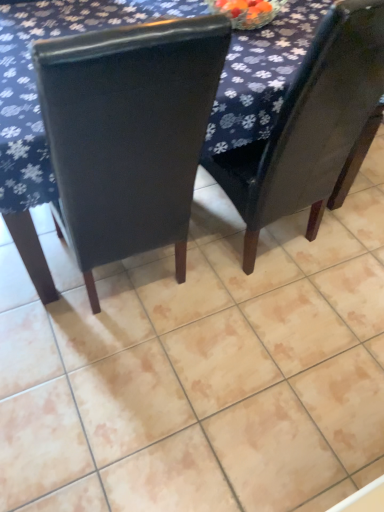
The image size is (384, 512). Find the location of `free spot to the right of matte black chair at center, acting as the 2th chair starting from the right`. free spot to the right of matte black chair at center, acting as the 2th chair starting from the right is located at coordinates (273, 325).